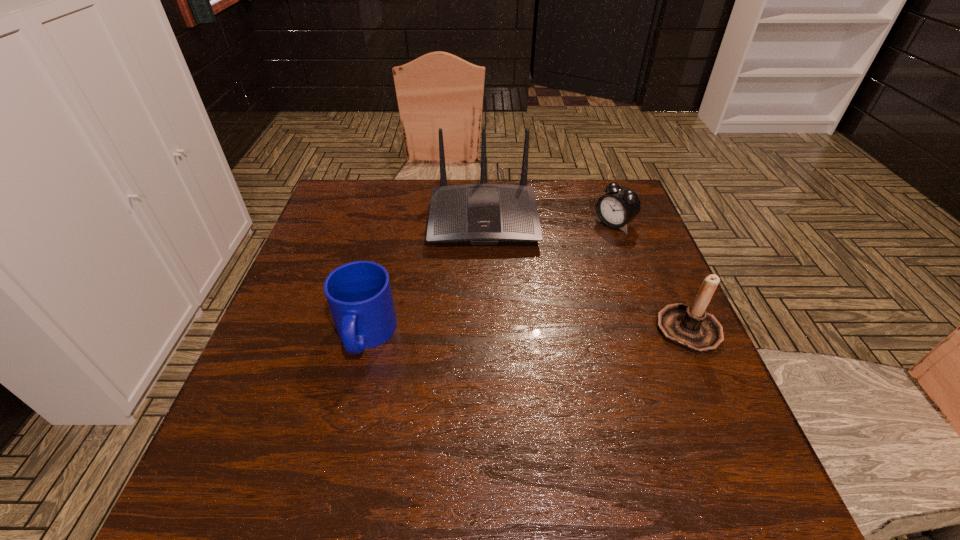
At what (x,y) coordinates should I click in order to perform the action: click on vacant region between the third shortest object and the alarm clock. Please return your answer as a coordinate pair (x, y). The width and height of the screenshot is (960, 540). Looking at the image, I should click on (651, 276).

This screenshot has height=540, width=960. What are the coordinates of `empty space between the tallest object and the second tallest object` in the screenshot? It's located at (586, 274).

This screenshot has height=540, width=960. I want to click on vacant area that lies between the router and the alarm clock, so click(x=549, y=221).

Locate an element on the screen. Image resolution: width=960 pixels, height=540 pixels. free space between the candle holder and the alarm clock is located at coordinates tap(651, 276).

Image resolution: width=960 pixels, height=540 pixels. In order to click on vacant area between the router and the alarm clock in this screenshot , I will do `click(549, 221)`.

Find the location of a particular element. Image resolution: width=960 pixels, height=540 pixels. object that is the second closest to the alarm clock is located at coordinates (690, 327).

Identify which object is the second nearest to the second tallest object. Please provide its 2D coordinates. Your answer should be formatted as a tuple, i.e. [(x, y)], where the tuple contains the x and y coordinates of a point satisfying the conditions above.

[(480, 214)]

Image resolution: width=960 pixels, height=540 pixels. I want to click on free spot that satisfies the following two spatial constraints: 1. on the front side of the candle holder; 2. on the left side of the tallest object, so click(x=485, y=329).